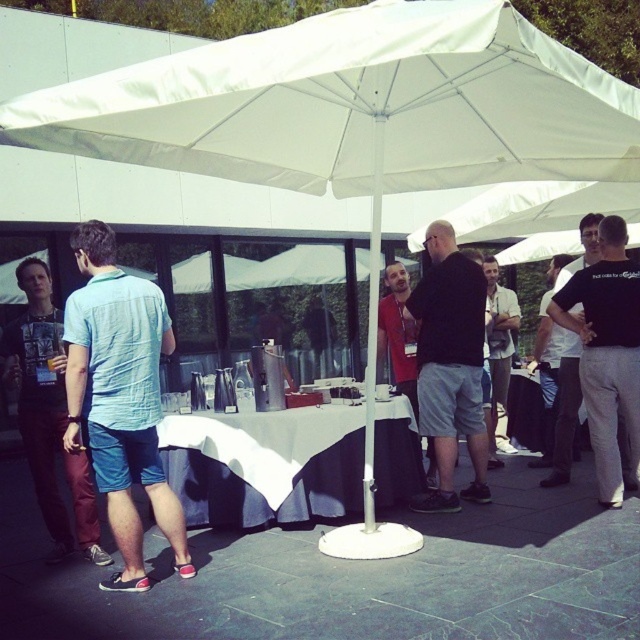
A person wearing a black matte shirt at center wants to hand a drink to someone standing 5.13 meters away. Can they do so without moving from their current position?

The distance between the black matte shirt at center and the person is 5.13 meters, so they cannot hand the drink without moving closer since the distance is too far to reach.

You are standing at the refreshment table under the large white umbrella and see two points marked in the image. Which point is closer to you, point (428, 358) or point (33, 456)?

Point (428, 358) is further to the viewer than point (33, 456), so the closer point to you is point (33, 456).